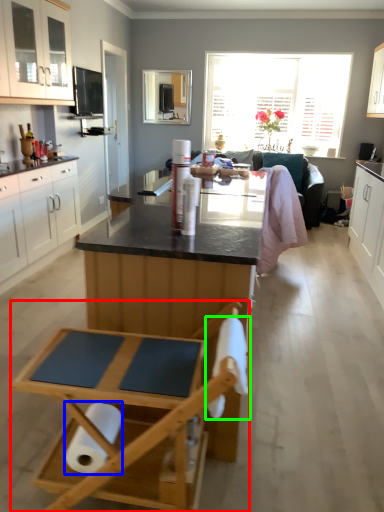
Question: Which object is the closest to the folding chair (highlighted by a red box)? Choose among these: toilet paper (highlighted by a blue box) or toilet paper (highlighted by a green box).

Choices:
 (A) toilet paper
 (B) toilet paper

Answer: (A)